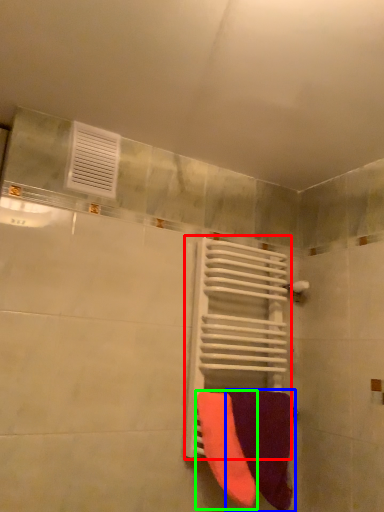
Question: Based on their relative distances, which object is farther from radiator (highlighted by a red box)? Choose from towel (highlighted by a blue box) and towel (highlighted by a green box).

Choices:
 (A) towel
 (B) towel

Answer: (B)